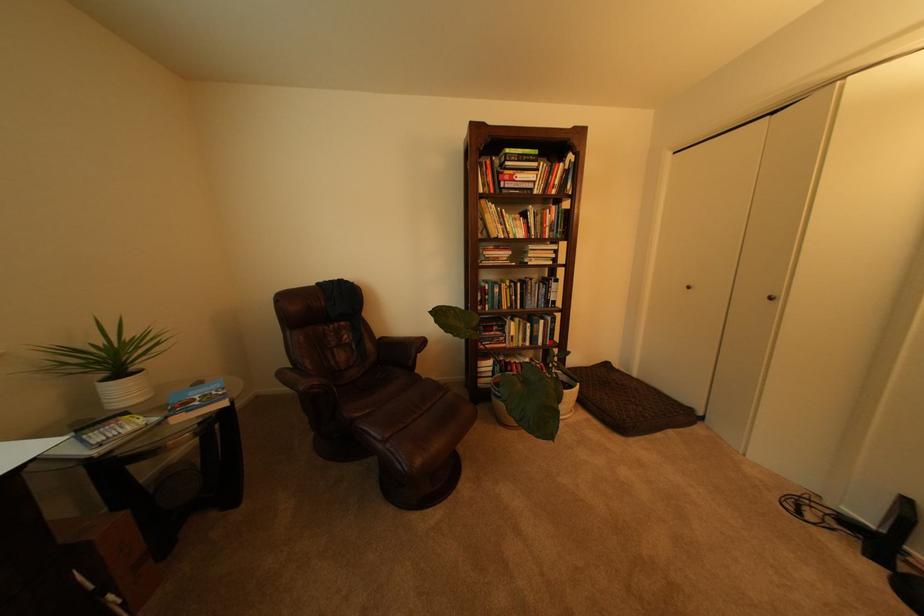
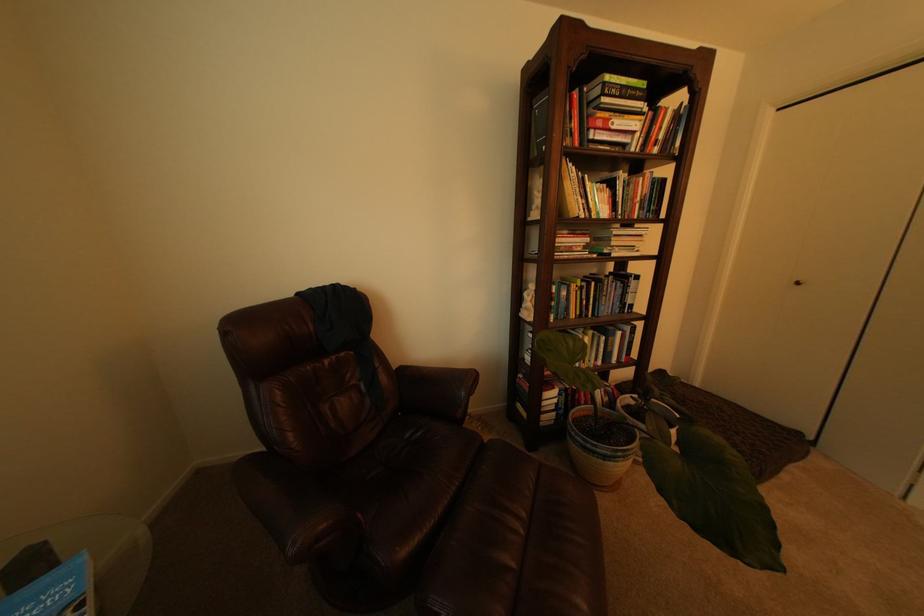
In a continuous first-person perspective shot, in which direction is the camera moving?

The movement direction of the cameraman is left, forward.